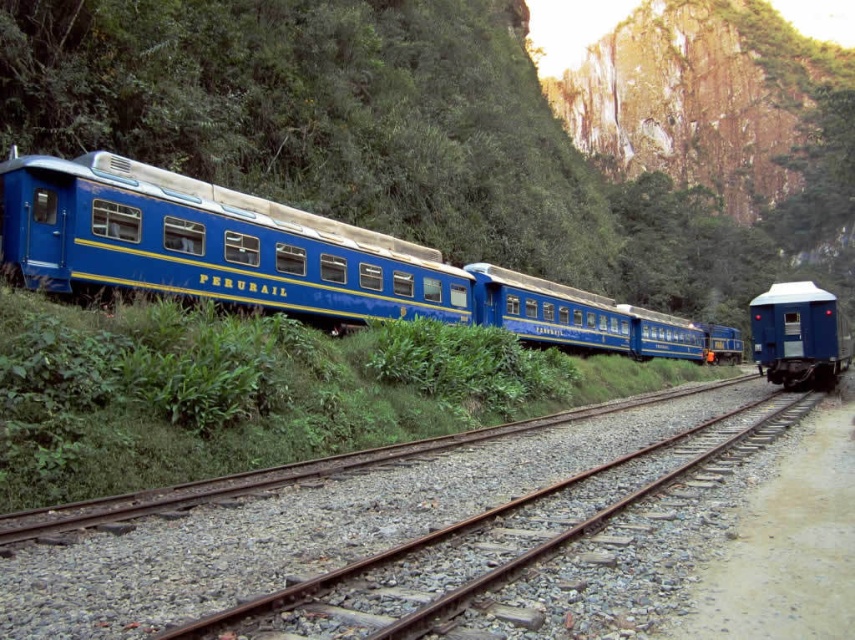
You are standing at the point closer to the viewer in the image. Which point are you at, point (469,509) or point (832,336)?

You are at point (469,509) because it is closer to the viewer than point (832,336).

You are a railway engineer inspecting the tracks. You notice the smooth gravel track at center and the matte blue train car at right. Which of these two objects takes up more space in the image?

The matte blue train car at right occupies more space than the smooth gravel track at center, as the gravel track is described as occupying less space.

You are a photographer standing on the train tracks and see two points in the scene, point [492,266] and point [148,561]. You want to take a photo that includes both points but focuses on the one closer to you. Which point should you focus on?

You should focus on point [148,561] because it is closer to you than point [492,266].